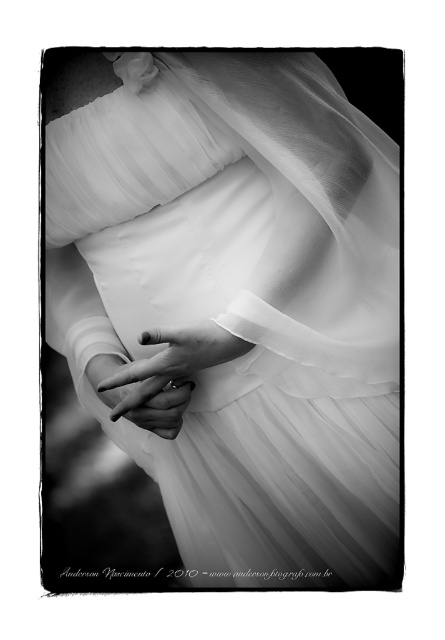
You are a photographer adjusting lighting for a photoshoot. You notice the translucent white dress at center and the smooth white hands at center. Which object should you focus on to ensure proper exposure, considering their size difference?

The translucent white dress at center is bigger than the smooth white hands at center, so you should focus on the translucent white dress at center for proper exposure since it occupies more of the frame.

You are a fashion designer trying to create a new dress design. You need to ensure that the dress will be wider than the model wearing it. Based on the image, can you confirm if the translucent white dress at center is wider than the smooth white hands at center?

The translucent white dress at center is wider than the smooth white hands at center, so yes, the dress is wider than the model wearing it.

You are a photographer adjusting the focus on a camera. The translucent white dress at center and the smooth white hands at center are both in the frame. Since both objects are white, how can you tell which one is closer to the camera?

The translucent white dress at center is closer to the camera than the smooth white hands at center because it is only 8.24 inches away from them, indicating proximity.